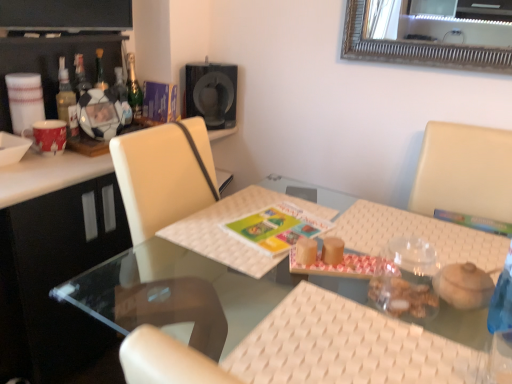
Question: Considering the relative sizes of matte plastic soccer ball at left and white woven placemat at center, which is the first place mat in left-to-right order, in the image provided, is matte plastic soccer ball at left taller than white woven placemat at center, which is the first place mat in left-to-right order,?

Choices:
 (A) yes
 (B) no

Answer: (A)

Question: Are matte plastic soccer ball at left and white woven placemat at center, which is the first place mat in left-to-right order, far apart?

Choices:
 (A) no
 (B) yes

Answer: (A)

Question: Considering the relative positions of matte plastic soccer ball at left and white woven placemat at center, the second place mat in the right-to-left sequence, in the image provided, is matte plastic soccer ball at left to the right of white woven placemat at center, the second place mat in the right-to-left sequence, from the viewer's perspective?

Choices:
 (A) no
 (B) yes

Answer: (A)

Question: Does matte plastic soccer ball at left have a lesser height compared to white woven placemat at center, which is the first place mat in left-to-right order?

Choices:
 (A) no
 (B) yes

Answer: (A)

Question: From a real-world perspective, does matte plastic soccer ball at left stand above white woven placemat at center, the second place mat in the right-to-left sequence?

Choices:
 (A) yes
 (B) no

Answer: (A)

Question: Looking at their shapes, would you say white matte bowl at upper left is wider or thinner than clear glass table at center?

Choices:
 (A) thin
 (B) wide

Answer: (A)

Question: Considering the positions of white matte bowl at upper left and clear glass table at center in the image, is white matte bowl at upper left bigger or smaller than clear glass table at center?

Choices:
 (A) big
 (B) small

Answer: (B)

Question: In the image, is white matte bowl at upper left on the left side or the right side of clear glass table at center?

Choices:
 (A) left
 (B) right

Answer: (A)

Question: In the image, is white matte bowl at upper left positioned in front of or behind clear glass table at center?

Choices:
 (A) behind
 (B) front

Answer: (A)

Question: From their relative heights in the image, would you say white matte bowl at upper left is taller or shorter than translucent glass bottle at left, the third bottle positioned from the back?

Choices:
 (A) tall
 (B) short

Answer: (B)

Question: From the image's perspective, is white matte bowl at upper left located above or below translucent glass bottle at left, marked as the first bottle in a front-to-back arrangement?

Choices:
 (A) above
 (B) below

Answer: (B)

Question: From a real-world perspective, relative to translucent glass bottle at left, marked as the first bottle in a front-to-back arrangement, is white matte bowl at upper left vertically above or below?

Choices:
 (A) above
 (B) below

Answer: (B)

Question: Is white matte bowl at upper left in front of or behind translucent glass bottle at left, marked as the first bottle in a front-to-back arrangement, in the image?

Choices:
 (A) front
 (B) behind

Answer: (A)

Question: Considering the positions of matte plastic soccer ball at left and translucent glass bottle at upper left, positioned as the second bottle in front-to-back order, in the image, is matte plastic soccer ball at left taller or shorter than translucent glass bottle at upper left, positioned as the second bottle in front-to-back order,?

Choices:
 (A) short
 (B) tall

Answer: (A)

Question: Is point (93, 112) positioned closer to the camera than point (121, 109)?

Choices:
 (A) farther
 (B) closer

Answer: (B)